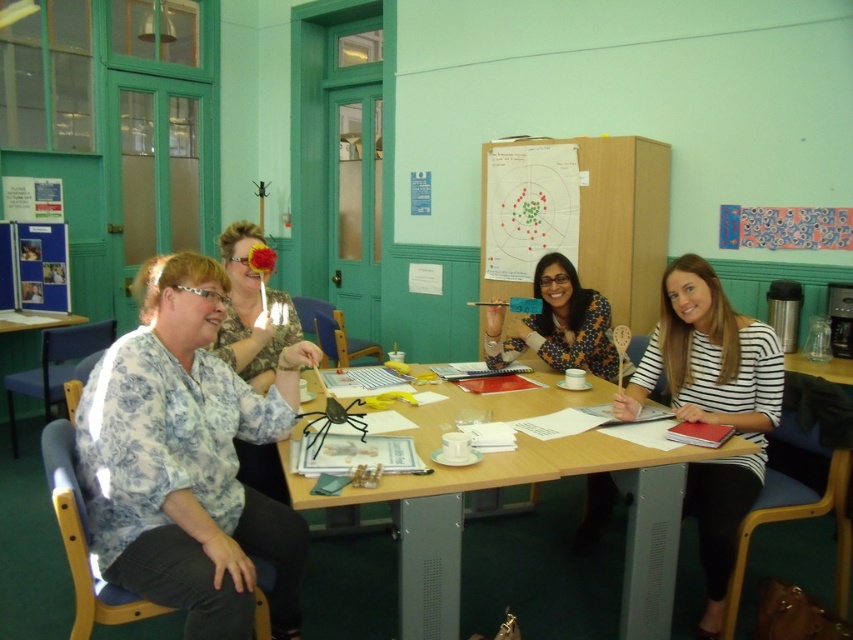
You are an observer looking at the scene. You notice two blouses on the table. The printed fabric blouse at center and the floral blouse at left. Which blouse is positioned higher up on the table?

The printed fabric blouse at center is above the floral blouse at left, so it is positioned higher up on the table.

You are organizing a clothing display and need to place the printed fabric blouse at center and the floral blouse at left on a shelf. Given their sizes, which blouse should you place first to ensure both fit on the shelf?

Since the printed fabric blouse at center takes up less space than the floral blouse at left, you should place the floral blouse at left first to make sure both can fit on the shelf.